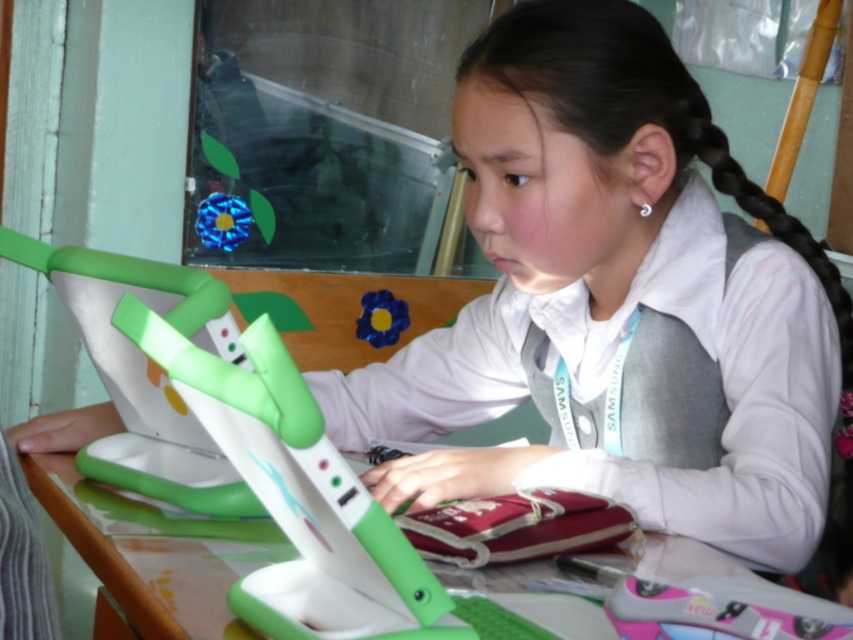
Question: Can you confirm if wooden table at lower center is wider than black hair at upper right?

Choices:
 (A) no
 (B) yes

Answer: (B)

Question: Which object is closer to the camera taking this photo?

Choices:
 (A) wooden table at lower center
 (B) black hair at upper right

Answer: (A)

Question: Which object appears closest to the camera in this image?

Choices:
 (A) black hair at upper right
 (B) wooden table at lower center

Answer: (B)

Question: Can you confirm if wooden table at lower center is positioned to the right of black hair at upper right?

Choices:
 (A) no
 (B) yes

Answer: (A)

Question: Can you confirm if wooden table at lower center is positioned to the right of black hair at upper right?

Choices:
 (A) no
 (B) yes

Answer: (A)